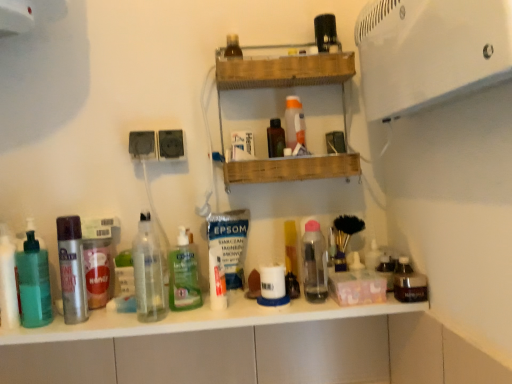
Question: Which is correct: translucent green pump bottle at left, marked as the 1th toiletry in a left-to-right arrangement, is inside wooden shelf at upper center, or outside of it?

Choices:
 (A) outside
 (B) inside

Answer: (A)

Question: From the image's perspective, relative to wooden shelf at upper center, is translucent green pump bottle at left, which appears as the third toiletry when ordered from the bottom, above or below?

Choices:
 (A) above
 (B) below

Answer: (B)

Question: Estimate the real-world distances between objects in this image. Which object is farther from the wooden shelf at upper center?

Choices:
 (A) green translucent bottle at center, which is counted as the second bottle, starting from the right
 (B) white glossy counter top at center
 (C) translucent green pump bottle at left, which appears as the third toiletry when ordered from the bottom
 (D) transparent plastic bottle at upper center, the 4th toiletry when ordered from bottom to top
 (E) transparent plastic bottle at center, which is the first bottle from right to left

Answer: (C)

Question: Which is nearer to the silver metallic spray can at left, placed as the second bottle when sorted from left to right?

Choices:
 (A) white matte tube at center, the 2th toiletry when ordered from left to right
 (B) translucent green pump bottle at left, which is the fourth toiletry from right to left
 (C) transparent plastic bottle at upper center, the 4th toiletry when ordered from bottom to top
 (D) clear glass bottle at center, the 3th bottle from the left
 (E) wooden shelf at upper center

Answer: (B)